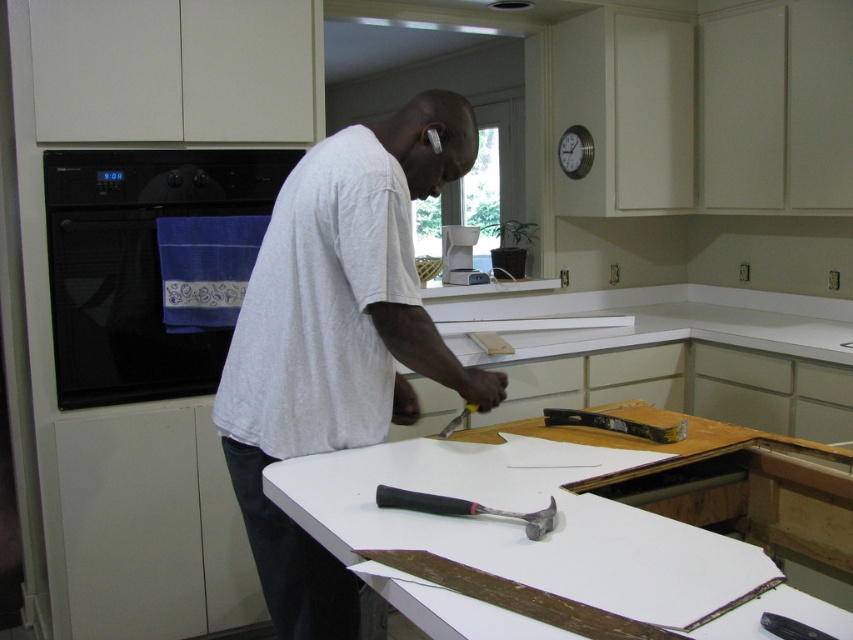
Question: Which object is farther from the camera taking this photo?

Choices:
 (A) black glass oven at left
 (B) white matte shirt at center
 (C) white laminate counter top at center

Answer: (A)

Question: Does metallic silver level at center have a larger size compared to white plastic coffee maker at center?

Choices:
 (A) yes
 (B) no

Answer: (B)

Question: Can you confirm if white laminate counter top at center is bigger than black glass oven at left?

Choices:
 (A) no
 (B) yes

Answer: (B)

Question: Among these objects, which one is nearest to the camera?

Choices:
 (A) black rubber hammer at center
 (B) white laminate counter top at center

Answer: (B)

Question: Does white matte shirt at center have a larger size compared to black rubber hammer at center?

Choices:
 (A) no
 (B) yes

Answer: (B)

Question: Estimate the real-world distances between objects in this image. Which object is closer to the white matte shirt at center?

Choices:
 (A) metallic silver level at center
 (B) black rubber hammer at center

Answer: (B)